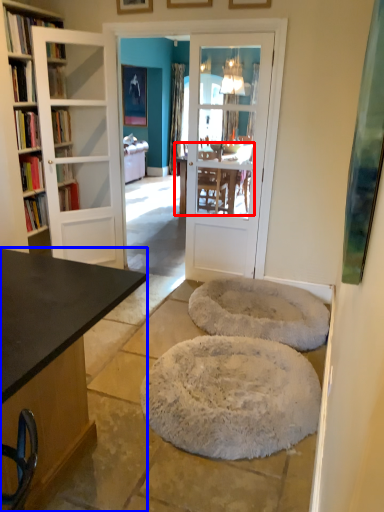
Question: Which object appears farthest to the camera in this image, kitchen & dining room table (highlighted by a red box) or desk (highlighted by a blue box)?

Choices:
 (A) kitchen & dining room table
 (B) desk

Answer: (A)